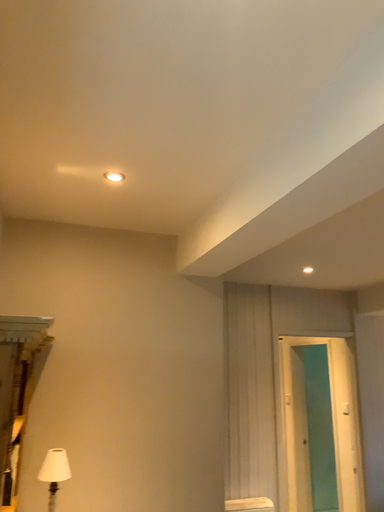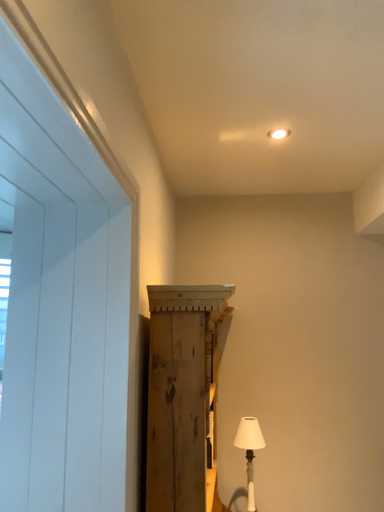
Question: Which way did the camera rotate in the video?

Choices:
 (A) rotated left
 (B) rotated right

Answer: (A)